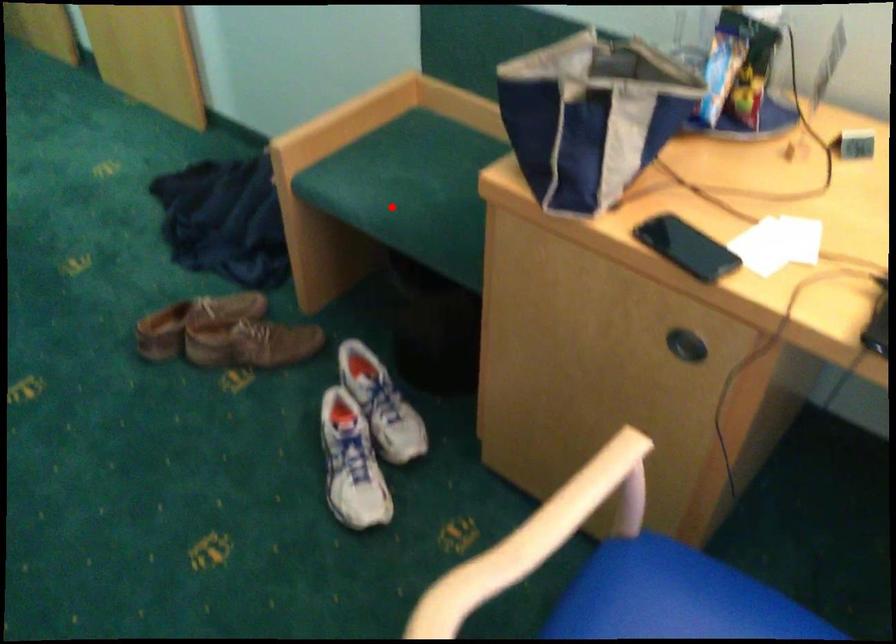
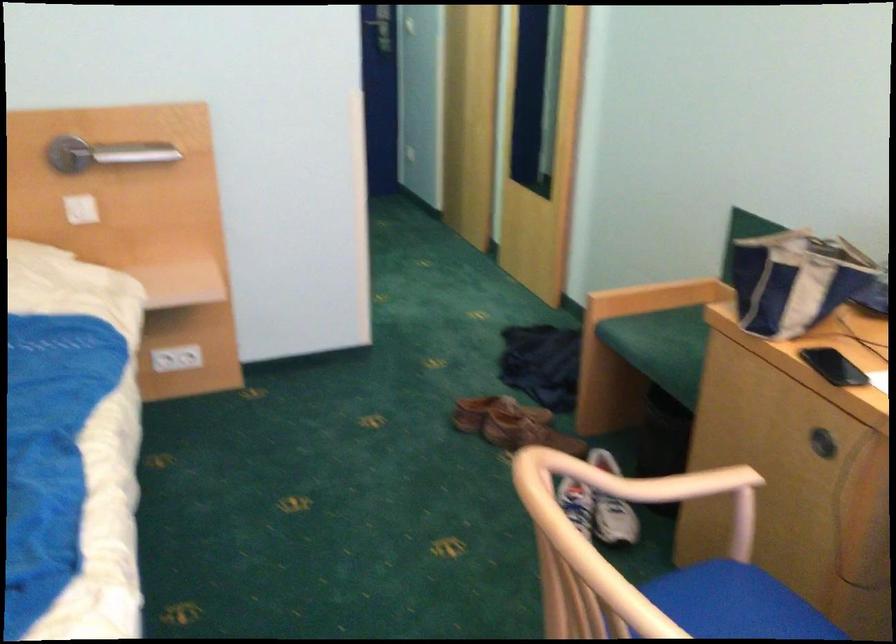
Locate, in the second image, the point that corresponds to the highlighted location in the first image.

(661, 346)